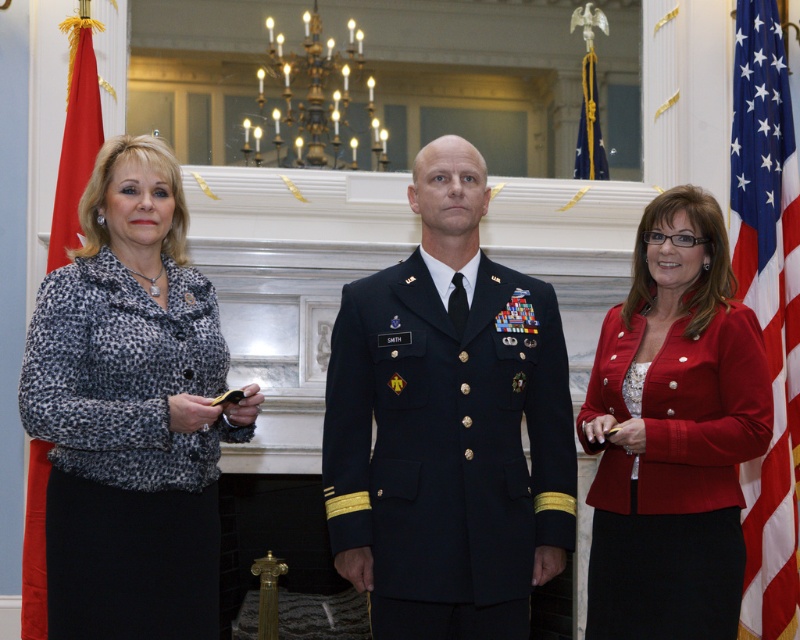
Question: Is leopard print fabric at left to the left of red fabric flag at left from the viewer's perspective?

Choices:
 (A) no
 (B) yes

Answer: (A)

Question: Which object is closer to the camera taking this photo?

Choices:
 (A) red fabric flag at left
 (B) red satin blazer at center
 (C) leopard print fabric at left
 (D) navy blue fabric military uniform at center

Answer: (C)

Question: Is navy blue fabric military uniform at center thinner than leopard print fabric at left?

Choices:
 (A) yes
 (B) no

Answer: (B)

Question: Which of the following is the closest to the observer?

Choices:
 (A) (29, 609)
 (B) (48, 417)

Answer: (B)

Question: Among these points, which one is farthest from the camera?

Choices:
 (A) (732, 609)
 (B) (376, 480)

Answer: (B)

Question: Is leopard print fabric at left further to camera compared to american flag at right?

Choices:
 (A) yes
 (B) no

Answer: (B)